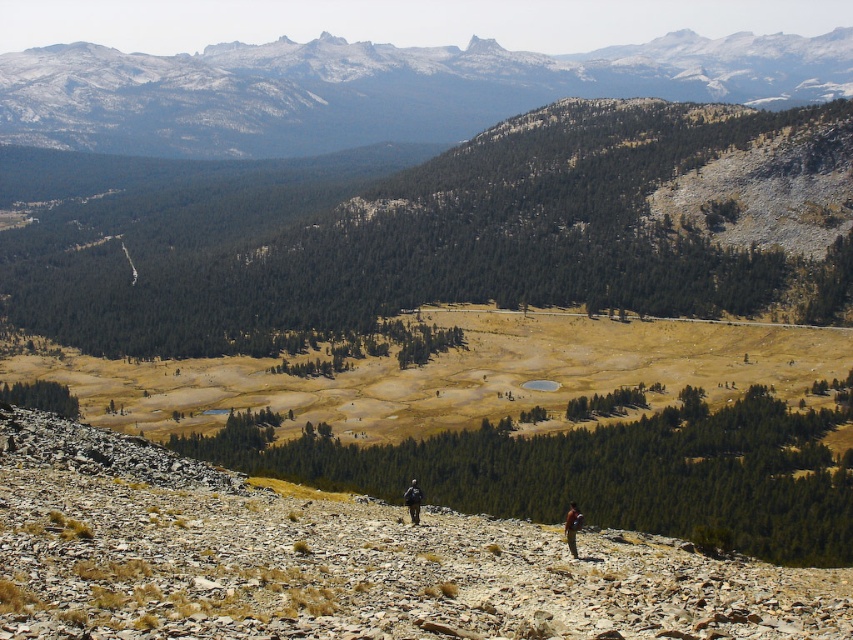
You are a hiker who just realized you dropped your brown leather jacket at lower center and your black fabric backpack at center. You want to retrieve both items. Which item should you pick up first if you are currently standing at the starting point between them?

You should pick up the black fabric backpack at center first because the brown leather jacket at lower center is to the right of the backpack, meaning the backpack is closer to your current position between them.

You are a hiker standing at the rocky slope in the foreground of the image. You want to reach the snowy granite mountain at upper center. Given that your average walking speed is 3 km per hour, how long would it take you to reach the mountain?

The snowy granite mountain at upper center is 517.49 meters away. At a walking speed of 3 km per hour, it would take approximately 10.35 minutes to reach the mountain.

You are a hiker standing at the base of the snowy granite mountain at upper center and want to reach the brown leather jacket at lower center. Which direction should you move to get closer to the jacket?

You should move downward towards the brown leather jacket at lower center because the snowy granite mountain at upper center is further away from the viewer compared to the jacket.